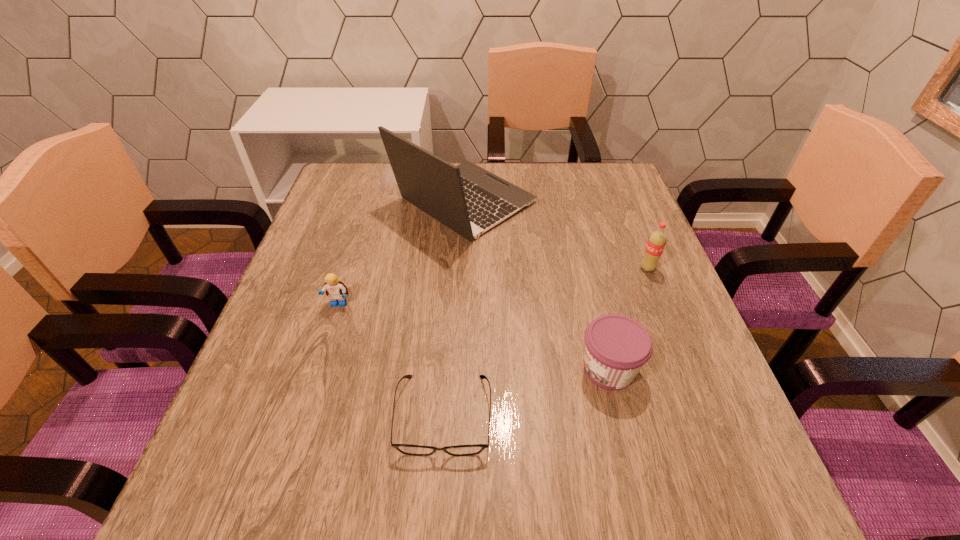
I want to click on vacant space in between the shortest object and the Lego, so click(391, 360).

Locate an element on the screen. free spot between the Lego and the tallest object is located at coordinates (401, 253).

The height and width of the screenshot is (540, 960). Find the location of `free space between the second object from right to left and the spectacles`. free space between the second object from right to left and the spectacles is located at coordinates (526, 392).

Locate an element on the screen. This screenshot has height=540, width=960. vacant space that's between the fourth object from left to right and the leftmost object is located at coordinates (x=473, y=336).

The height and width of the screenshot is (540, 960). I want to click on vacant space that is in between the fourth object from left to right and the shortest object, so click(x=526, y=392).

Select which object is the third closest to the shortest object. Please provide its 2D coordinates. Your answer should be formatted as a tuple, i.e. [(x, y)], where the tuple contains the x and y coordinates of a point satisfying the conditions above.

[(468, 199)]

The width and height of the screenshot is (960, 540). In order to click on object that stands as the fourth closest to the soda in this screenshot , I will do `click(336, 290)`.

You are a GUI agent. You are given a task and a screenshot of the screen. Output one action in this format:
    pyautogui.click(x=<x>, y=<y>)
    Task: Click on the free space in the image that satisfies the following two spatial constraints: 1. on the front label of the jam; 2. on the front-facing side of the spectacles
    This screenshot has width=960, height=540.
    Given the screenshot: What is the action you would take?
    pyautogui.click(x=620, y=415)